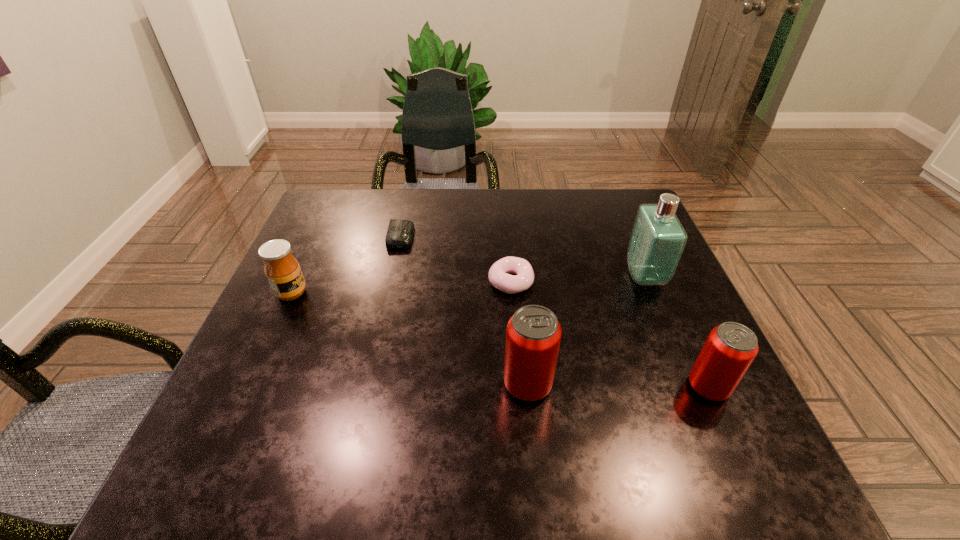
Please point a spot to add another can on the left. Please provide its 2D coordinates. Your answer should be formatted as a tuple, i.e. [(x, y)], where the tuple contains the x and y coordinates of a point satisfying the conditions above.

[(349, 382)]